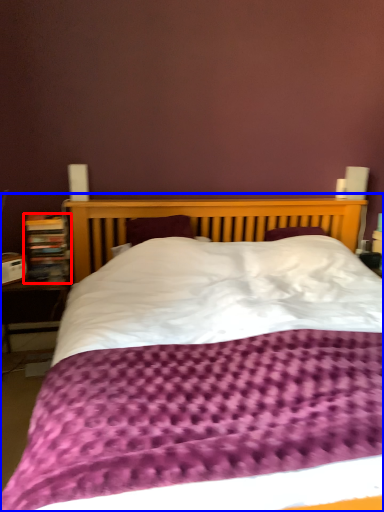
Question: Which of the following is the closest to the observer, bookcase (highlighted by a red box) or bed (highlighted by a blue box)?

Choices:
 (A) bookcase
 (B) bed

Answer: (B)